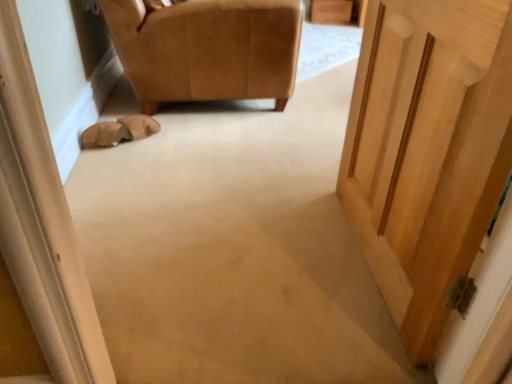
This screenshot has width=512, height=384. What do you see at coordinates (207, 49) in the screenshot?
I see `leather at upper left` at bounding box center [207, 49].

Where is `leather at upper left`? This screenshot has height=384, width=512. leather at upper left is located at coordinates (207, 49).

Measure the distance between point (178, 42) and camera.

Point (178, 42) and camera are 6.87 feet apart.

Locate an element on the screen. The image size is (512, 384). leather at left is located at coordinates (119, 131).

Describe the element at coordinates (119, 131) in the screenshot. I see `leather at left` at that location.

In order to click on leather at upper left in this screenshot , I will do `click(207, 49)`.

Which is more to the left, leather at left or leather at upper left?

From the viewer's perspective, leather at left appears more on the left side.

Is leather at left further to camera compared to leather at upper left?

Yes.

Which point is more forward, (90, 137) or (143, 97)?

Positioned in front is point (90, 137).

From the image's perspective, does leather at left appear higher than leather at upper left?

No, from the image's perspective, leather at left is not over leather at upper left.

From a real-world perspective, is leather at left positioned above or below leather at upper left?

leather at left is situated lower than leather at upper left in the real world.

From the picture: Is leather at left wider or thinner than leather at upper left?

Clearly, leather at left has less width compared to leather at upper left.

Is leather at left taller than leather at upper left?

No, leather at left is not taller than leather at upper left.

In terms of size, does leather at left appear bigger or smaller than leather at upper left?

Considering their sizes, leather at left takes up less space than leather at upper left.

Is leather at left surrounding leather at upper left?

Actually, leather at upper left is outside leather at left.

Is leather at left beside leather at upper left?

There is a gap between leather at left and leather at upper left.

Is leather at left aimed at leather at upper left?

No, leather at left is not turned towards leather at upper left.

How many degrees apart are the facing directions of leather at left and leather at upper left?

The angular difference between leather at left and leather at upper left is 10.5 degrees.

At what (x,y) coordinates should I click in order to perform the action: click on shoe below the leather at upper left (from a real-world perspective). Please return your answer as a coordinate pair (x, y). Looking at the image, I should click on (119, 131).

Is leather at upper left to the right of leather at left from the viewer's perspective?

Yes.

Between leather at upper left and leather at left, which one is positioned behind?

Positioned behind is leather at left.

Is point (290, 4) in front of point (119, 135)?

No, it is not.

From the image's perspective, is leather at upper left below leather at left?

No, from the image's perspective, leather at upper left is not beneath leather at left.

Based on the photo, from a real-world perspective, is leather at upper left on top of leather at left?

Yes, from a real-world perspective, leather at upper left is over leather at left

Considering the relative sizes of leather at upper left and leather at left in the image provided, is leather at upper left wider than leather at left?

Yes, leather at upper left is wider than leather at left.

Which of these two, leather at upper left or leather at left, stands shorter?

leather at left is shorter.

Between leather at upper left and leather at left, which one has smaller size?

leather at left is smaller.

Would you say leather at left is part of leather at upper left's contents?

Definitely not — leather at left is not inside leather at upper left.

Looking at this image, is leather at upper left with leather at left?

No, leather at upper left is not making contact with leather at left.

Is leather at upper left facing away from leather at left?

leather at upper left is not turned away from leather at left.

Measure the distance from leather at upper left to leather at left.

A distance of 18.01 inches exists between leather at upper left and leather at left.

The image size is (512, 384). Identify the location of chair on the right of leather at left. (207, 49).

The image size is (512, 384). Identify the location of chair in front of the leather at left. (207, 49).

You are a GUI agent. You are given a task and a screenshot of the screen. Output one action in this format:
    pyautogui.click(x=<x>, y=<y>)
    Task: Click on the chair located above the leather at left (from a real-world perspective)
    
    Given the screenshot: What is the action you would take?
    pyautogui.click(x=207, y=49)